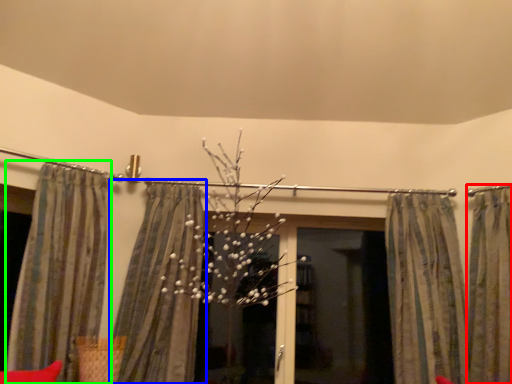
Question: Which object is positioned farthest from curtain (highlighted by a red box)? Select from curtain (highlighted by a blue box) and curtain (highlighted by a green box).

Choices:
 (A) curtain
 (B) curtain

Answer: (B)